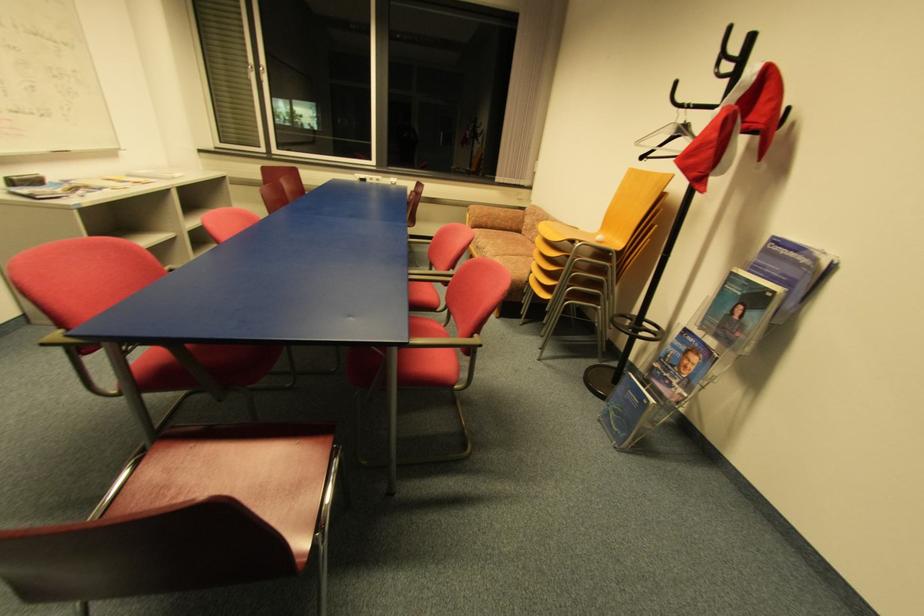
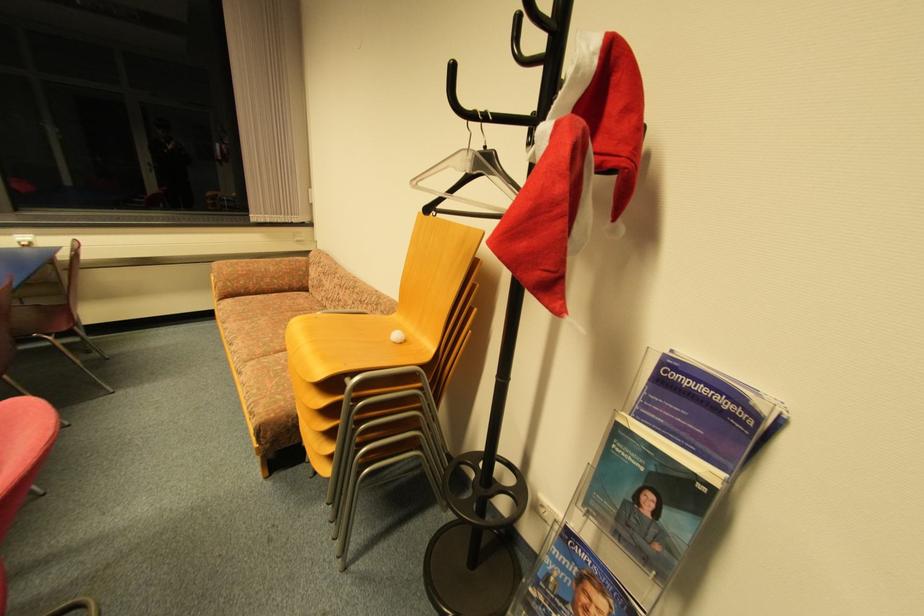
Where in the second image is the point corresponding to (505,215) from the first image?

(275, 270)